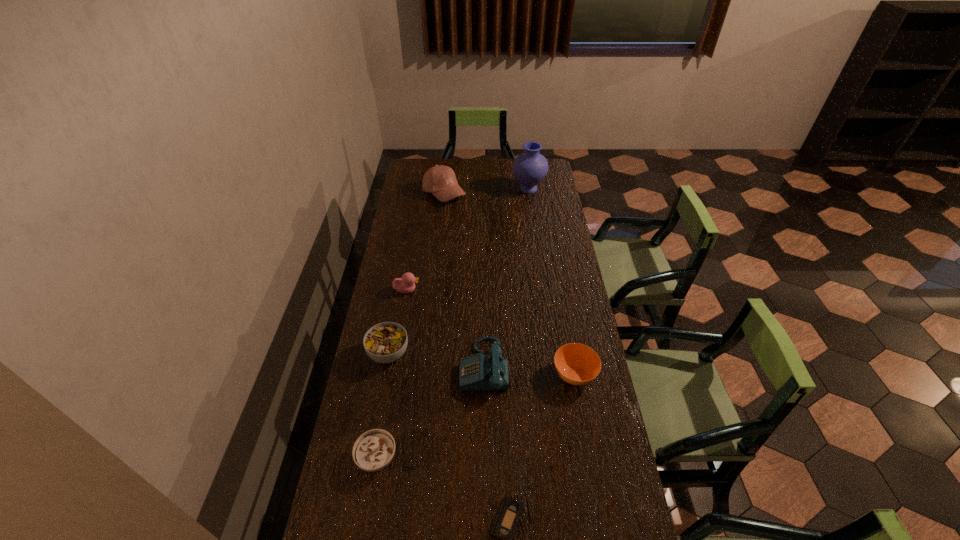
You are a GUI agent. You are given a task and a screenshot of the screen. Output one action in this format:
    pyautogui.click(x=<x>, y=<y>)
    Task: Click on the vase
    The image size is (960, 540).
    Given the screenshot: What is the action you would take?
    pyautogui.click(x=530, y=168)

Image resolution: width=960 pixels, height=540 pixels. I want to click on baseball cap, so click(440, 180).

Identify the location of the third farthest object. This screenshot has height=540, width=960. coord(406,284).

Locate an element on the screen. The image size is (960, 540). telephone is located at coordinates (477, 372).

Where is `the rightmost soup bowl`? Image resolution: width=960 pixels, height=540 pixels. the rightmost soup bowl is located at coordinates (577, 364).

Where is `the nearest soup bowl`? the nearest soup bowl is located at coordinates tap(373, 450).

At what (x,y) coordinates should I click in order to perform the action: click on the seventh farthest object. Please return your answer as a coordinate pair (x, y). The height and width of the screenshot is (540, 960). Looking at the image, I should click on (373, 450).

You are a GUI agent. You are given a task and a screenshot of the screen. Output one action in this format:
    pyautogui.click(x=<x>, y=<y>)
    Task: Click on the free point located on the left of the vase
    
    Given the screenshot: What is the action you would take?
    pyautogui.click(x=439, y=189)

You are a GUI agent. You are given a task and a screenshot of the screen. Output one action in this format:
    pyautogui.click(x=<x>, y=<y>)
    Task: Click on the free location located 0.290m on the front-facing side of the seventh shortest object
    
    Given the screenshot: What is the action you would take?
    pyautogui.click(x=521, y=194)

Locate an element on the screen. vacant area situated 0.380m on the front-facing side of the duckling is located at coordinates (514, 290).